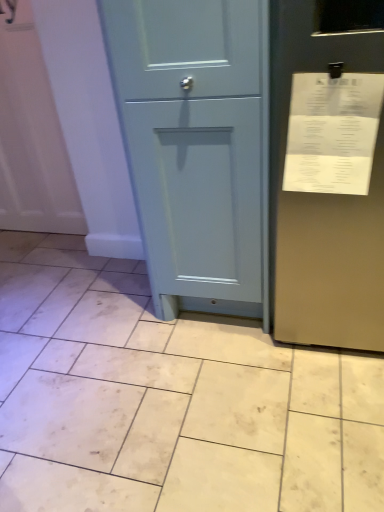
Locate an element on the screen. vacant area that is in front of white glossy tile at lower left, which is the 1th ceramic tile from top to bottom is located at coordinates (28, 275).